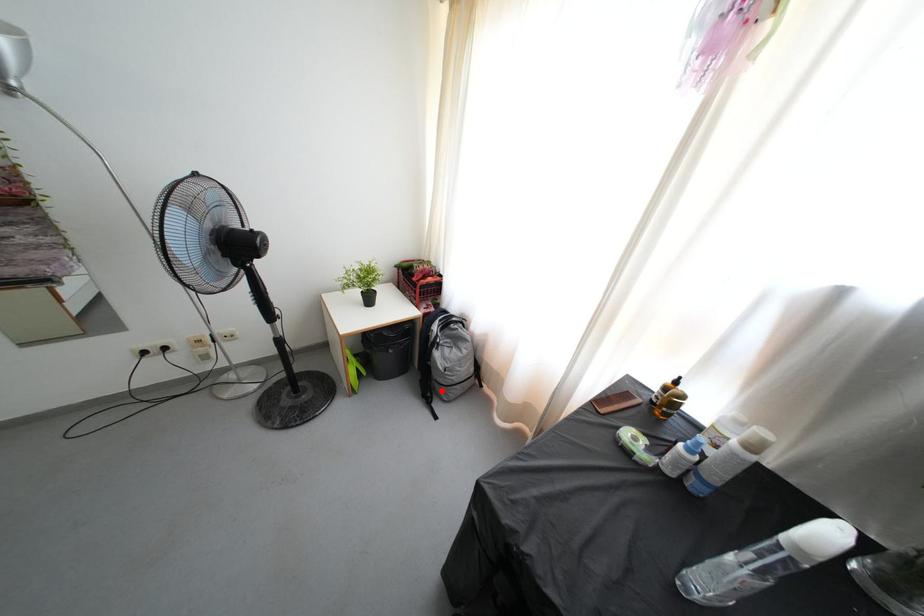
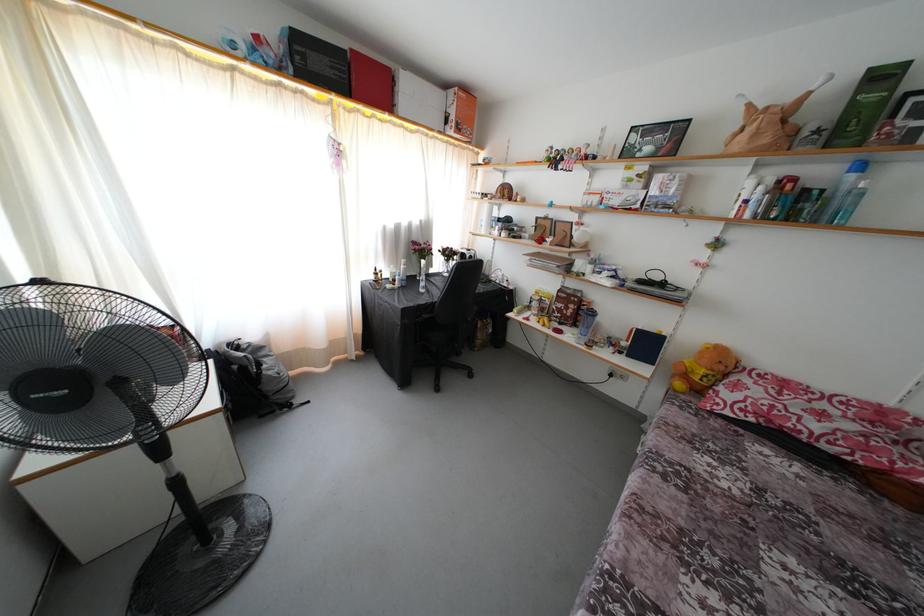
Question: A red point is marked in image1. In image2, is the corresponding 3D point closer to the camera or farther? Reply with the corresponding letter.

Choices:
 (A) The corresponding 3D point is closer.
 (B) The corresponding 3D point is farther.

Answer: (A)